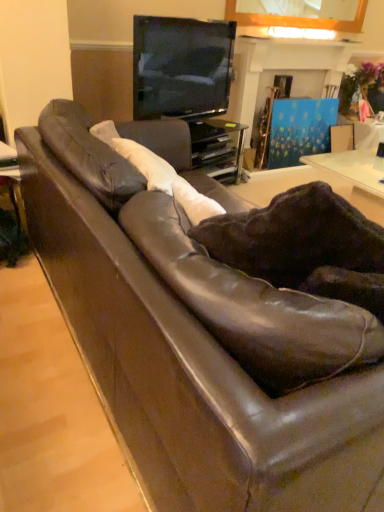
The width and height of the screenshot is (384, 512). What do you see at coordinates (283, 72) in the screenshot?
I see `blue painted wood fireplace at upper center` at bounding box center [283, 72].

What are the coordinates of `matte brown table at left` in the screenshot? It's located at (12, 181).

What are the coordinates of `black glass entertainment center at upper center` in the screenshot? It's located at (217, 149).

You are a GUI agent. You are given a task and a screenshot of the screen. Output one action in this format:
    pyautogui.click(x=<x>, y=<y>)
    Task: Click on the leather swivel chair at center
    
    Given the screenshot: What is the action you would take?
    pyautogui.click(x=252, y=305)

Is leather swivel chair at center next to matte brown table at left?

No, leather swivel chair at center is not touching matte brown table at left.

Considering the relative positions of leather swivel chair at center and matte brown table at left in the image provided, is leather swivel chair at center to the right of matte brown table at left from the viewer's perspective?

Correct, you'll find leather swivel chair at center to the right of matte brown table at left.

Where is `swivel chair on the right of matte brown table at left`? This screenshot has height=512, width=384. swivel chair on the right of matte brown table at left is located at coordinates (252, 305).

Is leather swivel chair at center further to camera compared to matte brown table at left?

That is False.

Which is more to the left, blue painted wood fireplace at upper center or black glass entertainment center at upper center?

Positioned to the left is black glass entertainment center at upper center.

In the scene shown: From a real-world perspective, is blue painted wood fireplace at upper center above or below black glass entertainment center at upper center?

In terms of real-world spatial position, blue painted wood fireplace at upper center is above black glass entertainment center at upper center.

In terms of width, does blue painted wood fireplace at upper center look wider or thinner when compared to black glass entertainment center at upper center?

Clearly, blue painted wood fireplace at upper center has more width compared to black glass entertainment center at upper center.

Does blue painted wood fireplace at upper center have a greater height compared to leather swivel chair at center?

Indeed, blue painted wood fireplace at upper center has a greater height compared to leather swivel chair at center.

Which object is thinner, blue painted wood fireplace at upper center or leather swivel chair at center?

leather swivel chair at center is thinner.

From the image's perspective, is blue painted wood fireplace at upper center over leather swivel chair at center?

Correct, blue painted wood fireplace at upper center appears higher than leather swivel chair at center in the image.

I want to click on fireplace behind the leather swivel chair at center, so click(x=283, y=72).

Which is more distant, (238, 150) or (215, 309)?

The point (238, 150) is farther from the camera.

Looking at their sizes, would you say black glass entertainment center at upper center is wider or thinner than leather swivel chair at center?

In the image, black glass entertainment center at upper center appears to be wider than leather swivel chair at center.

In terms of height, does black glass entertainment center at upper center look taller or shorter compared to leather swivel chair at center?

Clearly, black glass entertainment center at upper center is shorter compared to leather swivel chair at center.

In the scene shown: Is black glass entertainment center at upper center with leather swivel chair at center?

No, black glass entertainment center at upper center is not touching leather swivel chair at center.

Which object is further away from the camera, matte brown table at left or matte black tv at upper center?

matte black tv at upper center is further away from the camera.

Find the location of a particular element. This screenshot has height=512, width=384. table in front of the matte black tv at upper center is located at coordinates (12, 181).

From the image's perspective, is matte brown table at left over matte black tv at upper center?

No, from the image's perspective, matte brown table at left is not over matte black tv at upper center.

Is matte black tv at upper center inside matte brown table at left?

Definitely not — matte black tv at upper center is not inside matte brown table at left.

How many degrees apart are the facing directions of matte black tv at upper center and leather swivel chair at center?

The angle between the facing direction of matte black tv at upper center and the facing direction of leather swivel chair at center is 125 degrees.

From the image's perspective, relative to leather swivel chair at center, is matte black tv at upper center above or below?

Based on their image positions, matte black tv at upper center is located above leather swivel chair at center.

Does matte black tv at upper center contain leather swivel chair at center?

Actually, leather swivel chair at center is outside matte black tv at upper center.

Is matte black tv at upper center in contact with leather swivel chair at center?

matte black tv at upper center and leather swivel chair at center are clearly separated.

Is leather swivel chair at center thinner than matte black tv at upper center?

No.

Could matte black tv at upper center be considered to be inside leather swivel chair at center?

No, matte black tv at upper center is not surrounded by leather swivel chair at center.

What's the angular difference between leather swivel chair at center and matte black tv at upper center's facing directions?

125 degrees.

This screenshot has width=384, height=512. Identify the location of table that is under the leather swivel chair at center (from a real-world perspective). (12, 181).

In the image, there is a blue painted wood fireplace at upper center. Where is `entertainment center below it (from the image's perspective)`? The width and height of the screenshot is (384, 512). entertainment center below it (from the image's perspective) is located at coordinates (217, 149).

When comparing their distances from matte brown table at left, does matte black tv at upper center or blue painted wood fireplace at upper center seem closer?

matte black tv at upper center is positioned closer to the anchor matte brown table at left.

When comparing their distances from blue painted wood fireplace at upper center, does leather swivel chair at center or black glass entertainment center at upper center seem further?

Based on the image, leather swivel chair at center appears to be further to blue painted wood fireplace at upper center.

In the scene shown: Considering their positions, is leather swivel chair at center positioned further to matte black tv at upper center than matte brown table at left?

leather swivel chair at center is further to matte black tv at upper center.

From the image, which object appears to be nearer to matte black tv at upper center, blue painted wood fireplace at upper center or leather swivel chair at center?

The object closer to matte black tv at upper center is blue painted wood fireplace at upper center.

Which object lies further to the anchor point matte black tv at upper center, black glass entertainment center at upper center or matte brown table at left?

matte brown table at left is further to matte black tv at upper center.

Looking at the image, which one is located further to matte brown table at left, black glass entertainment center at upper center or leather swivel chair at center?

black glass entertainment center at upper center lies further to matte brown table at left than the other object.

Estimate the real-world distances between objects in this image. Which object is further from matte brown table at left, blue painted wood fireplace at upper center or leather swivel chair at center?

Among the two, blue painted wood fireplace at upper center is located further to matte brown table at left.

Considering their positions, is blue painted wood fireplace at upper center positioned closer to leather swivel chair at center than black glass entertainment center at upper center?

black glass entertainment center at upper center is positioned closer to the anchor leather swivel chair at center.

Locate an element on the screen. The image size is (384, 512). entertainment center situated between matte black tv at upper center and blue painted wood fireplace at upper center from left to right is located at coordinates (217, 149).

Find the location of a particular element. This screenshot has height=512, width=384. table positioned between leather swivel chair at center and matte black tv at upper center from near to far is located at coordinates (12, 181).

Locate an element on the screen. The image size is (384, 512). table between leather swivel chair at center and blue painted wood fireplace at upper center from front to back is located at coordinates (12, 181).

Where is `entertainment center situated between matte brown table at left and blue painted wood fireplace at upper center from left to right`? The image size is (384, 512). entertainment center situated between matte brown table at left and blue painted wood fireplace at upper center from left to right is located at coordinates (217, 149).